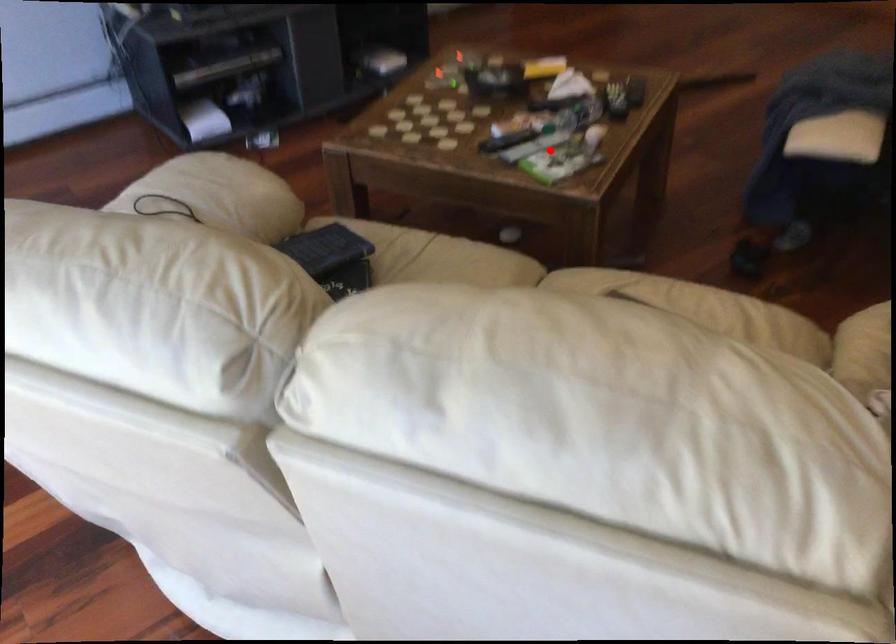
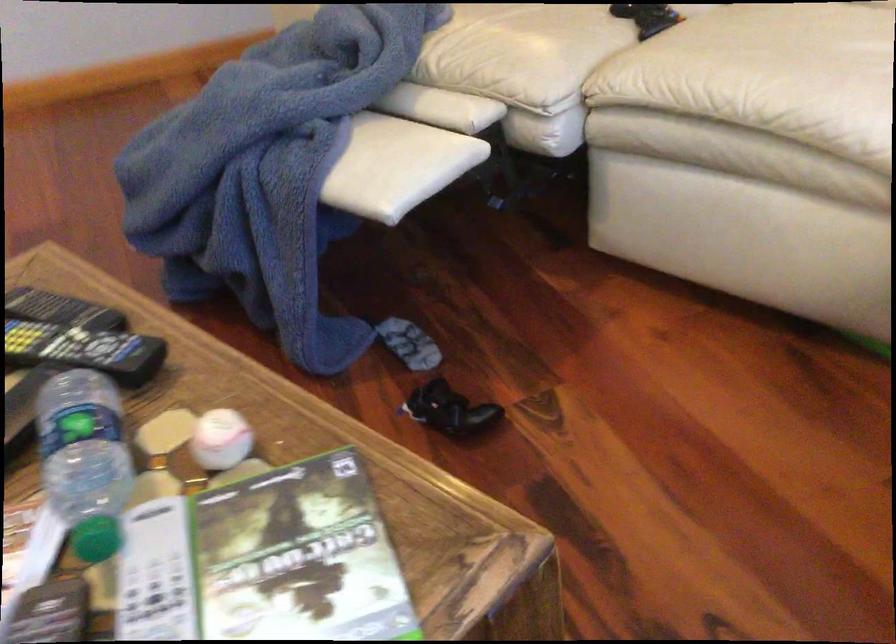
Where in the second image is the point corresponding to the highlighted location from the first image?

(298, 556)